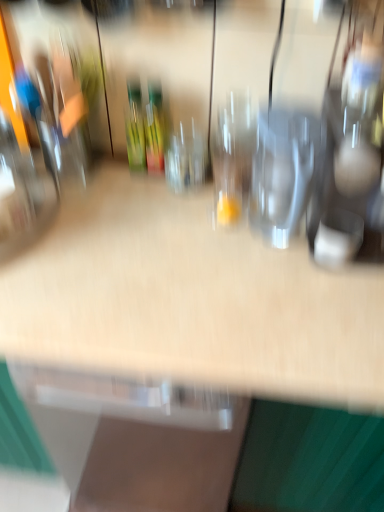
Locate an element on the screen. The width and height of the screenshot is (384, 512). free space in front of green glass wine bottle at center is located at coordinates (142, 207).